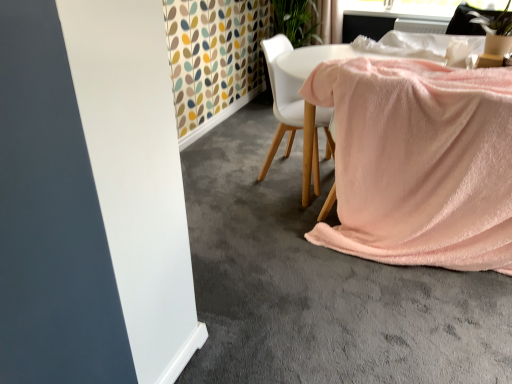
Where is `free location above pink soft blanket at lower right (from a real-world perspective)`? This screenshot has width=512, height=384. free location above pink soft blanket at lower right (from a real-world perspective) is located at coordinates coord(279,228).